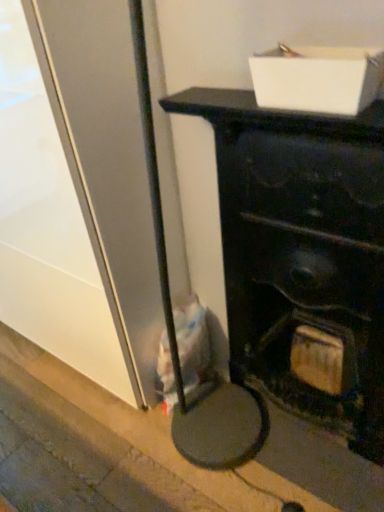
Question: In terms of height, does matte black fireplace at center look taller or shorter compared to concrete at lower left?

Choices:
 (A) tall
 (B) short

Answer: (A)

Question: In terms of width, does matte black fireplace at center look wider or thinner when compared to concrete at lower left?

Choices:
 (A) thin
 (B) wide

Answer: (A)

Question: Which of these objects is positioned farthest from the matte black fireplace at center?

Choices:
 (A) white cardboard box at upper center
 (B) concrete at lower left

Answer: (B)

Question: Which is farther from the matte black fireplace at center?

Choices:
 (A) white cardboard box at upper center
 (B) concrete at lower left

Answer: (B)